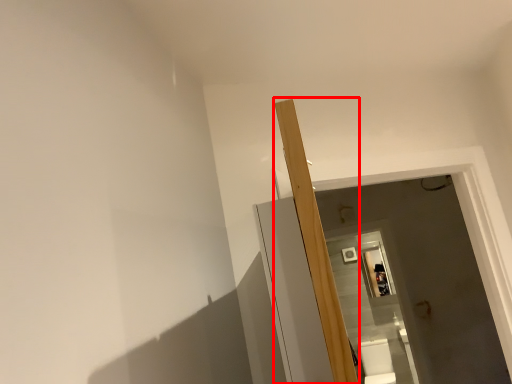
Question: Where is beam (annotated by the red box) located in relation to toilet bowl in the image?

Choices:
 (A) left
 (B) right

Answer: (A)